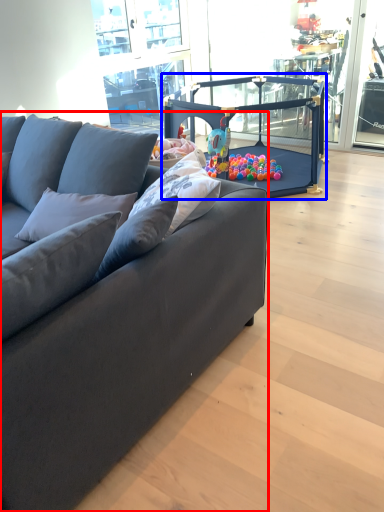
Question: Which object is closer to the camera taking this photo, studio couch (highlighted by a red box) or baby carriage (highlighted by a blue box)?

Choices:
 (A) studio couch
 (B) baby carriage

Answer: (A)